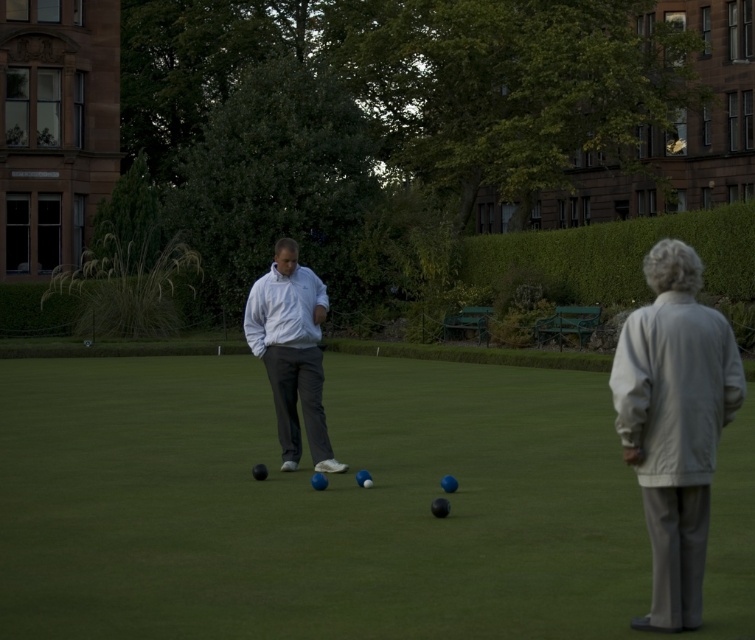
Question: Does light gray fabric jacket at right have a lesser width compared to white matte jacket at center?

Choices:
 (A) yes
 (B) no

Answer: (B)

Question: Which point is closer to the camera taking this photo?

Choices:
 (A) (390, 410)
 (B) (307, 394)
 (C) (686, 416)

Answer: (C)

Question: Among these points, which one is farthest from the camera?

Choices:
 (A) (544, 461)
 (B) (672, 600)
 (C) (260, 352)

Answer: (A)

Question: Where is green grass at center located in relation to light gray fabric jacket at right in the image?

Choices:
 (A) above
 (B) below

Answer: (B)

Question: In this image, where is light gray fabric jacket at right located relative to white matte jacket at center?

Choices:
 (A) below
 (B) above

Answer: (A)

Question: Which point appears farthest from the camera in this image?

Choices:
 (A) (695, 353)
 (B) (276, 300)
 (C) (22, 365)

Answer: (C)